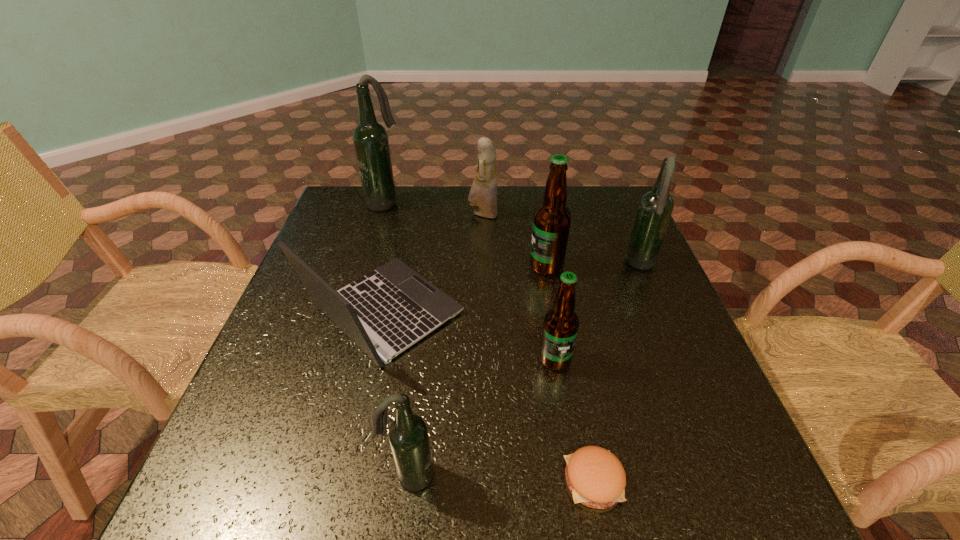
Find the location of a particular element. Image resolution: width=960 pixels, height=540 pixels. dark beer bottle that is the third closest one to the smaller brown beer bottle is located at coordinates (370, 138).

The width and height of the screenshot is (960, 540). What are the coordinates of `vacant space that satisfies the following two spatial constraints: 1. on the label of the shortest object; 2. on the left side of the bigger brown beer bottle` in the screenshot? It's located at (585, 481).

What are the coordinates of `vacant position in the image that satisfies the following two spatial constraints: 1. at the front screen of the laptop_computer; 2. on the right side of the patty` in the screenshot? It's located at (345, 481).

You are a GUI agent. You are given a task and a screenshot of the screen. Output one action in this format:
    pyautogui.click(x=<x>, y=<y>)
    Task: Click on the free spot that satisfies the following two spatial constraints: 1. on the front-facing side of the rightmost beer bottle; 2. on the right side of the figurine
    
    Given the screenshot: What is the action you would take?
    pyautogui.click(x=484, y=265)

I want to click on free point that satisfies the following two spatial constraints: 1. on the front-facing side of the shortest object; 2. on the left side of the fifth object from right to left, so click(486, 481).